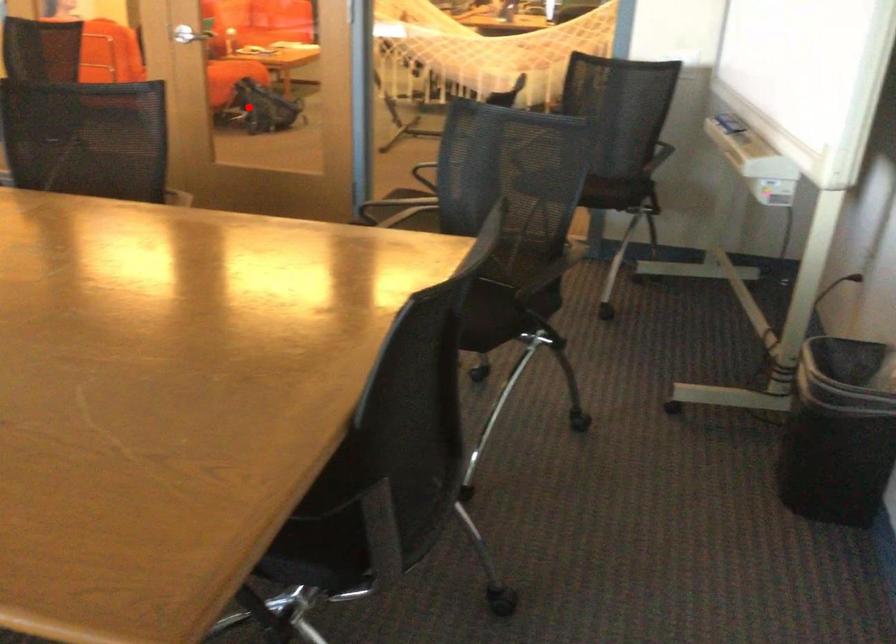
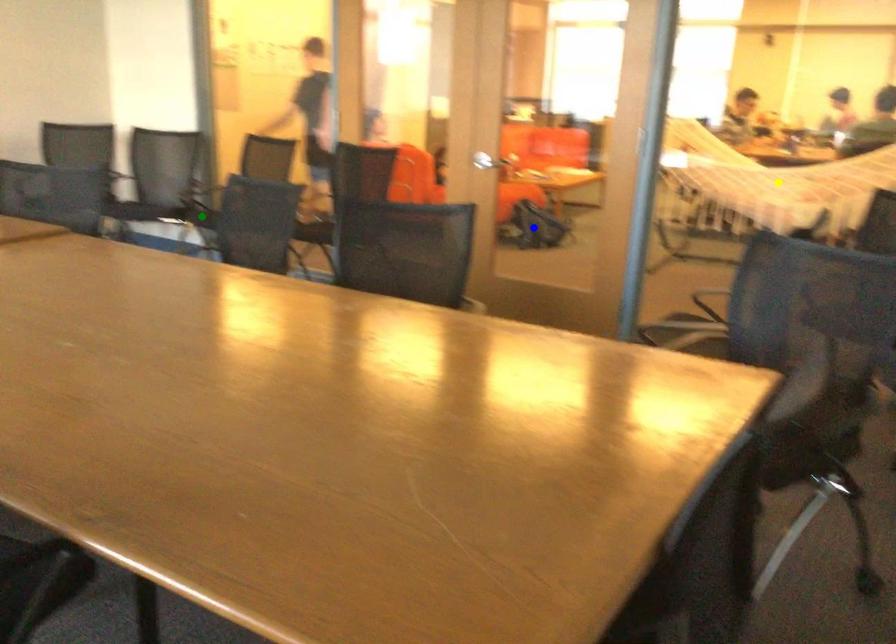
Question: I am providing you with two images of the same scene from different viewpoints. A red point is marked on the first image. You are given multiple points on the second image. In image 2, which mark is for the same physical point as the one in image 1?

Choices:
 (A) yellow point
 (B) blue point
 (C) green point

Answer: (B)